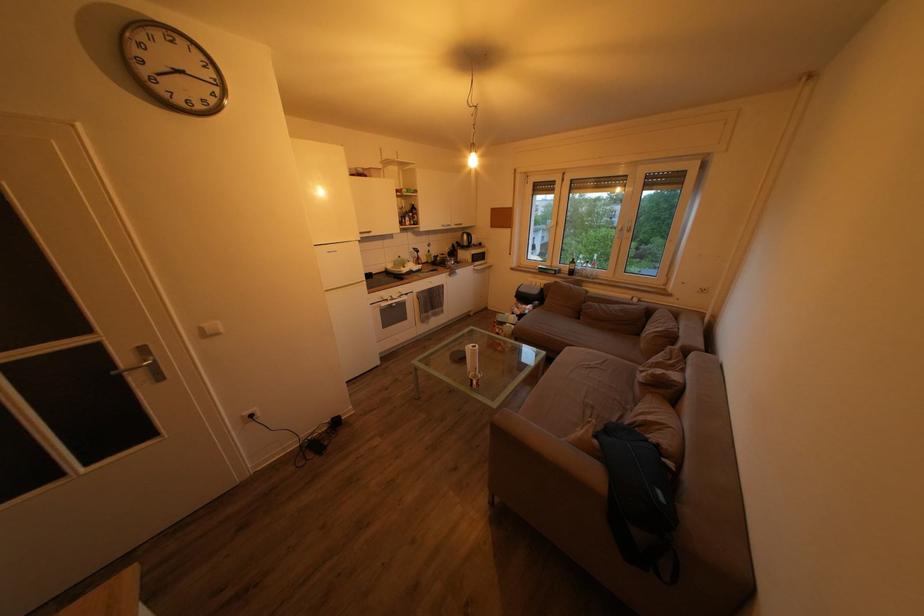
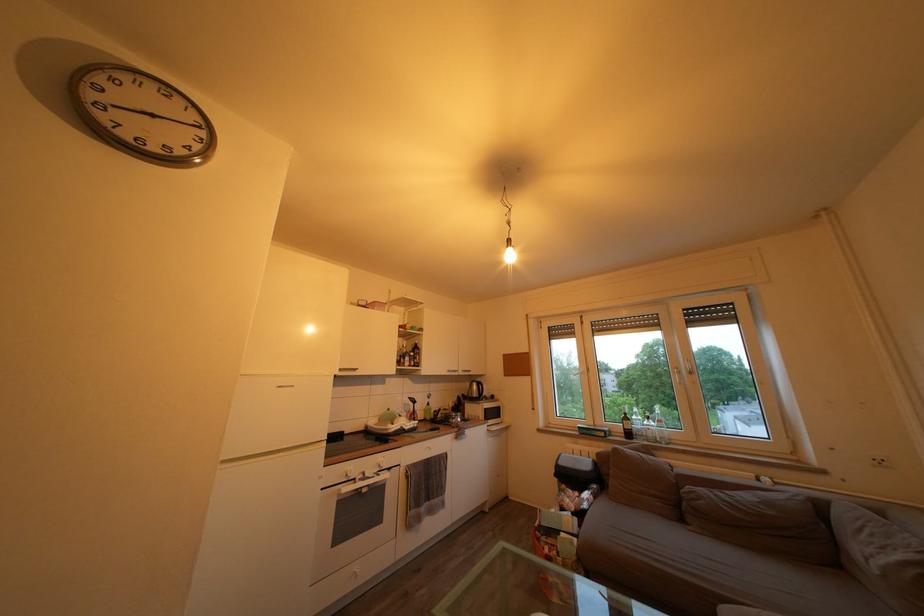
In the second image, find the point that corresponds to point 473,244 in the first image.

(482, 392)